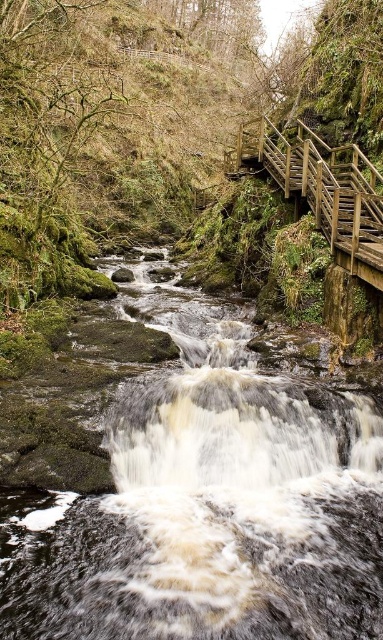
Does point (217, 317) come in front of point (258, 122)?

Yes, it is.

Is point (173, 484) positioned after point (379, 257)?

No, (173, 484) is in front of (379, 257).

Does point (258, 570) come closer to viewer compared to point (286, 179)?

Yes, point (258, 570) is in front of point (286, 179).

You are a GUI agent. You are given a task and a screenshot of the screen. Output one action in this format:
    pyautogui.click(x=<x>, y=<y>)
    Task: Click on the dark gray stone stream at center
    
    Given the screenshot: What is the action you would take?
    pyautogui.click(x=209, y=502)

Which is above, dark gray stone stream at center or green mossy rock at center?

green mossy rock at center

Is point (166, 326) positioned in front of point (114, 276)?

Yes, point (166, 326) is closer to viewer.

The width and height of the screenshot is (383, 640). I want to click on dark gray stone stream at center, so click(209, 502).

Between wooden stairs at upper center and green mossy rock at center, which one is positioned lower?

green mossy rock at center

Between wooden stairs at upper center and green mossy rock at center, which one has less height?

Standing shorter between the two is green mossy rock at center.

Does point (276, 170) come closer to viewer compared to point (119, 282)?

Yes, point (276, 170) is closer to viewer.

At what (x,y) coordinates should I click in order to perform the action: click on wooden stairs at upper center. Please return your answer as a coordinate pair (x, y). This screenshot has width=383, height=640. Looking at the image, I should click on [325, 189].